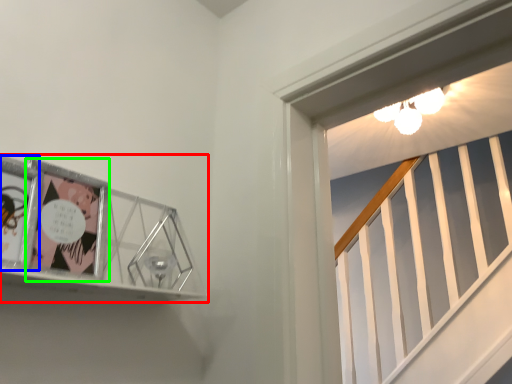
Question: Estimate the real-world distances between objects in this image. Which object is closer to picture frame (highlighted by a red box), comic book (highlighted by a blue box) or comic book (highlighted by a green box)?

Choices:
 (A) comic book
 (B) comic book

Answer: (B)